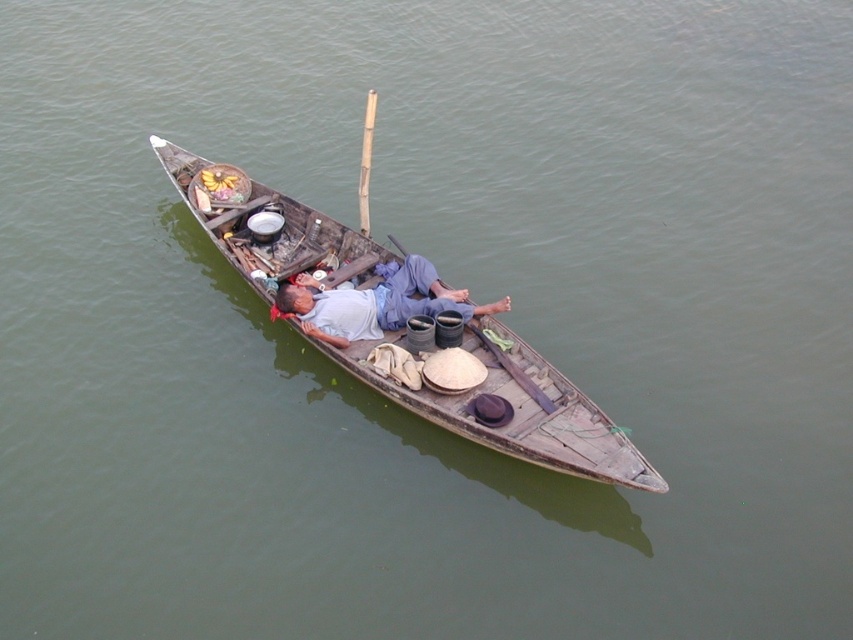
Question: From the image, what is the correct spatial relationship of wooden boat at center in relation to gray fabric shirt at center?

Choices:
 (A) above
 (B) below

Answer: (B)

Question: Is wooden boat at center positioned behind gray fabric shirt at center?

Choices:
 (A) yes
 (B) no

Answer: (B)

Question: Can you confirm if wooden boat at center is positioned to the left of gray fabric shirt at center?

Choices:
 (A) no
 (B) yes

Answer: (A)

Question: Which of the following is the closest to the observer?

Choices:
 (A) pos(498,392)
 (B) pos(456,294)

Answer: (A)